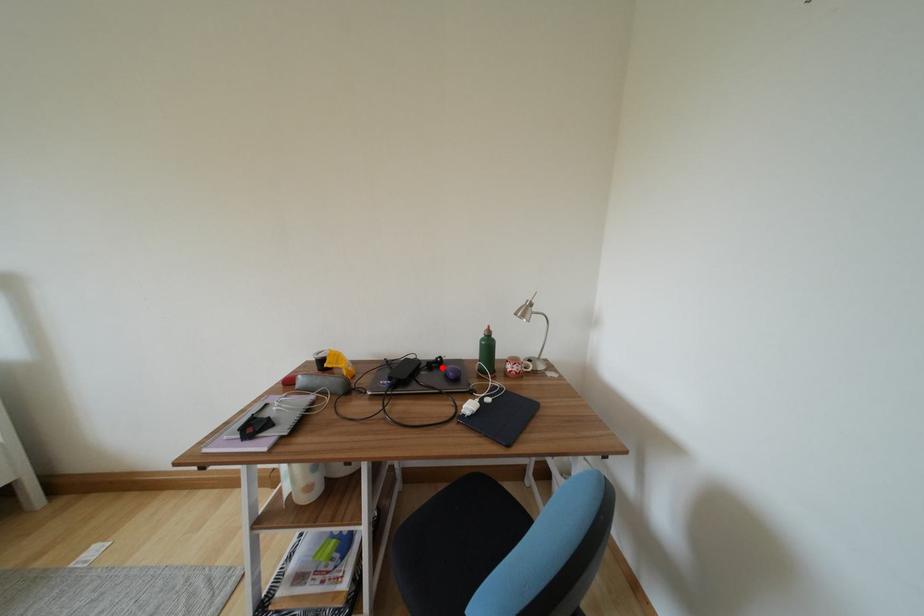
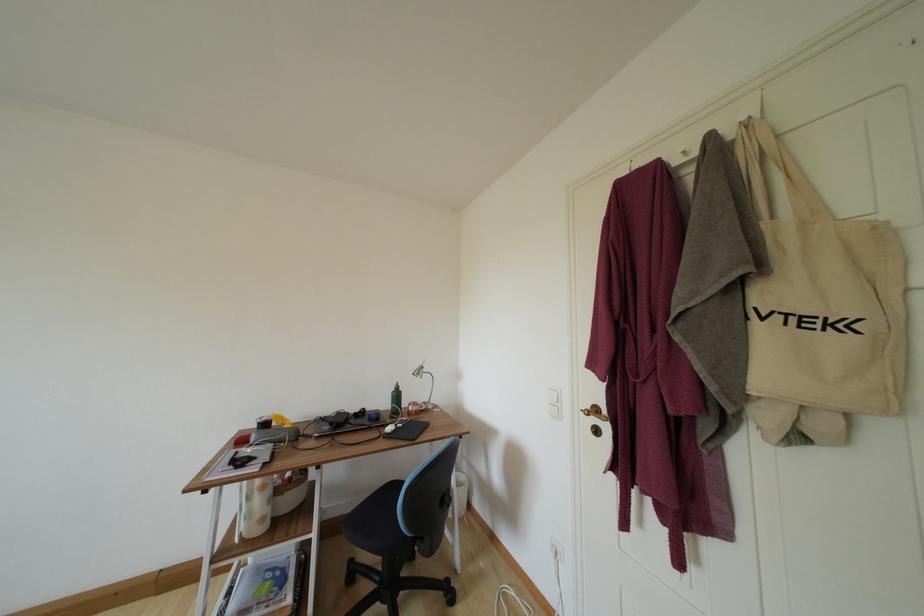
Locate, in the second image, the point that corresponds to the highlighted location in the first image.

(367, 416)